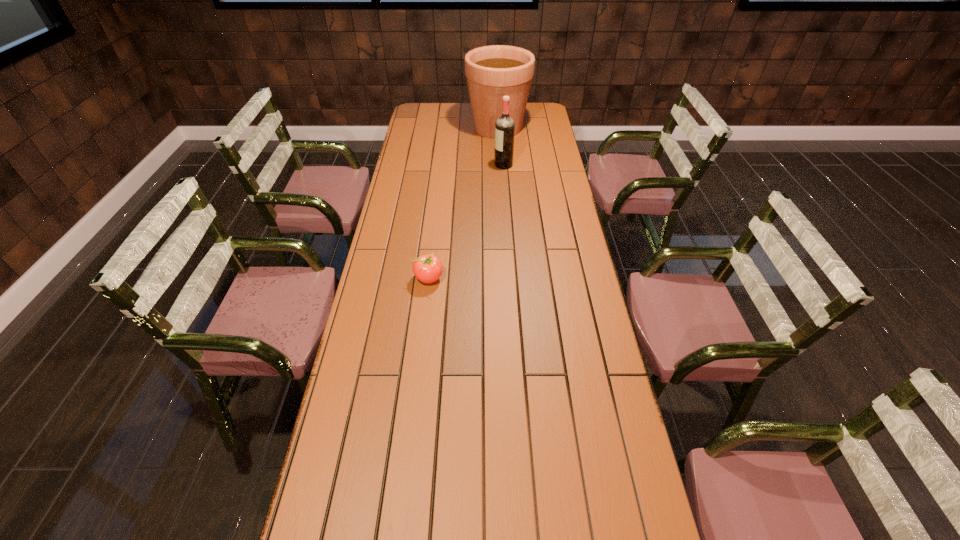
Find the location of a particular element. the farthest object is located at coordinates tap(494, 71).

Image resolution: width=960 pixels, height=540 pixels. I want to click on the second farthest object, so click(x=504, y=126).

Locate an element on the screen. The width and height of the screenshot is (960, 540). the shortest object is located at coordinates (427, 268).

Find the location of a particular element. This screenshot has width=960, height=540. the nearest object is located at coordinates (427, 268).

At what (x,y) coordinates should I click in order to perform the action: click on free spot located 0.050m on the front of the flowerpot. Please return your answer as a coordinate pair (x, y). The height and width of the screenshot is (540, 960). Looking at the image, I should click on (499, 149).

Where is `free spot located on the front-facing side of the second nearest object`? free spot located on the front-facing side of the second nearest object is located at coordinates (408, 165).

Image resolution: width=960 pixels, height=540 pixels. In order to click on free space located on the front-facing side of the second nearest object in this screenshot , I will do `click(423, 165)`.

Image resolution: width=960 pixels, height=540 pixels. Identify the location of vacant region located on the front-facing side of the second nearest object. (421, 165).

The image size is (960, 540). Find the location of `free location located 0.300m on the right of the nearest object`. free location located 0.300m on the right of the nearest object is located at coordinates (534, 278).

Identify the location of object that is at the far edge. The width and height of the screenshot is (960, 540). (494, 71).